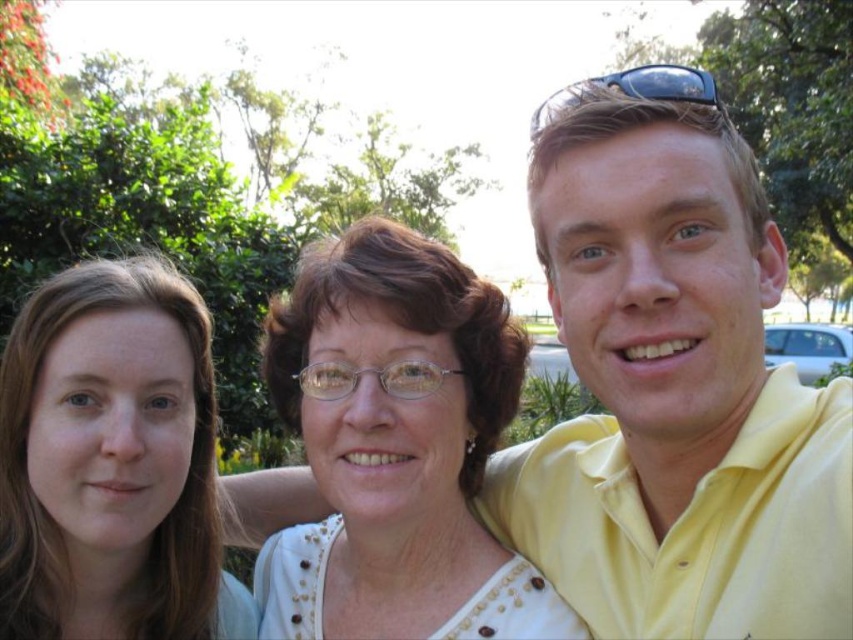
You are a photographer trying to capture a candid shot of the smooth skin face at left and the black plastic sunglasses at upper right. Since you want to ensure both subjects are in focus, you need to know their relative positions. Which object is positioned further to the left?

The smooth skin face at left is positioned further to the left compared to the black plastic sunglasses at upper right.

You are a photographer adjusting the camera focus. You notice the smooth skin face at left and the black plastic sunglasses at upper right in your viewfinder. Which object should you focus on first if you want to capture both in sharp detail, considering their sizes?

The smooth skin face at left has a lesser width compared to the black plastic sunglasses at upper right, so you should focus on the black plastic sunglasses at upper right first since it is larger and may require more precise focusing to ensure sharpness.

You are a photographer trying to capture a closeup shot of the yellow satin shirt at upper right and the smooth skin face at left simultaneously. Given that your camera has a maximum focus range of 30 inches, will you be able to achieve this without moving the subjects?

The yellow satin shirt at upper right and smooth skin face at left are 31.64 inches apart, which exceeds the camera maximum focus range of 30 inches. Therefore, you cannot capture both in focus without moving the subjects closer together.